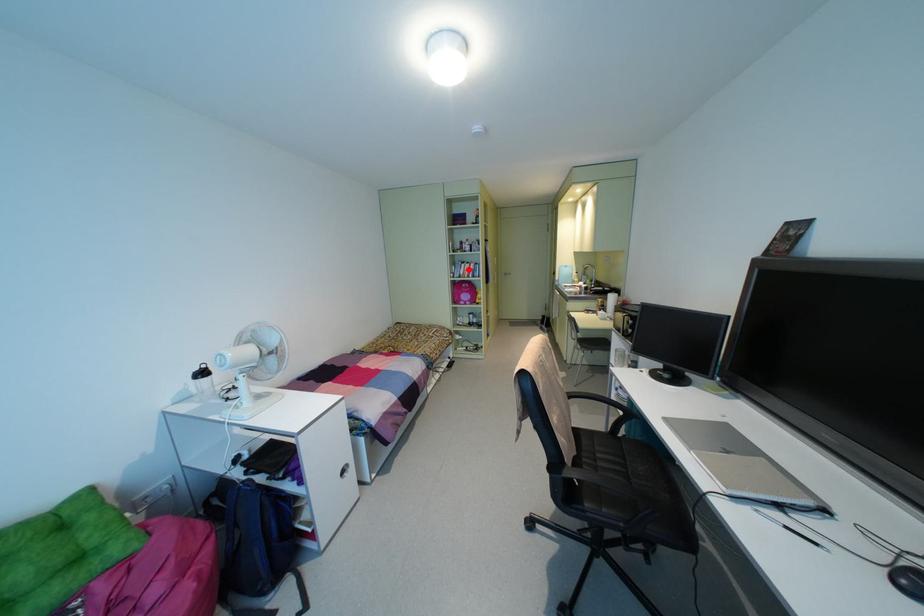
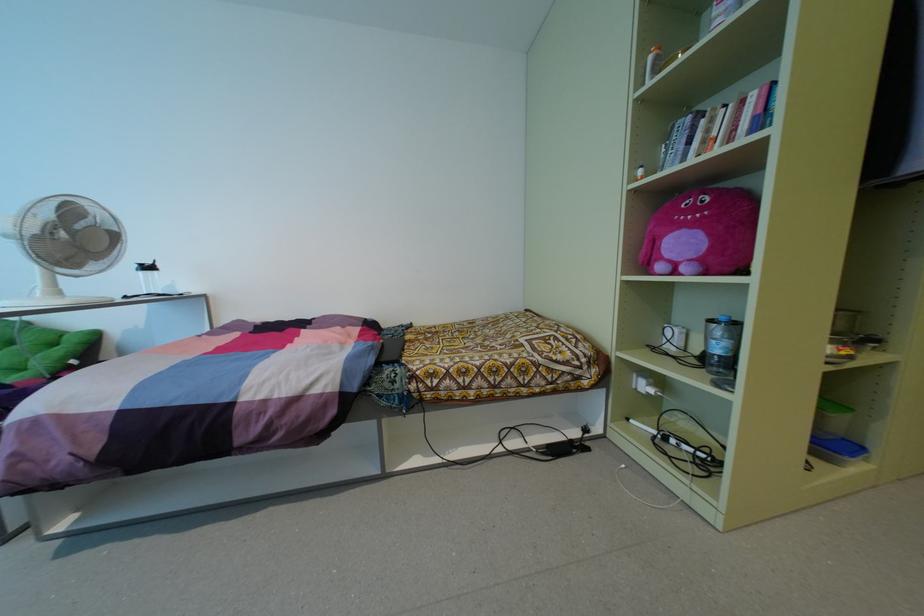
Where in the second image is the point corresponding to the highlighted location from the first image?

(734, 129)